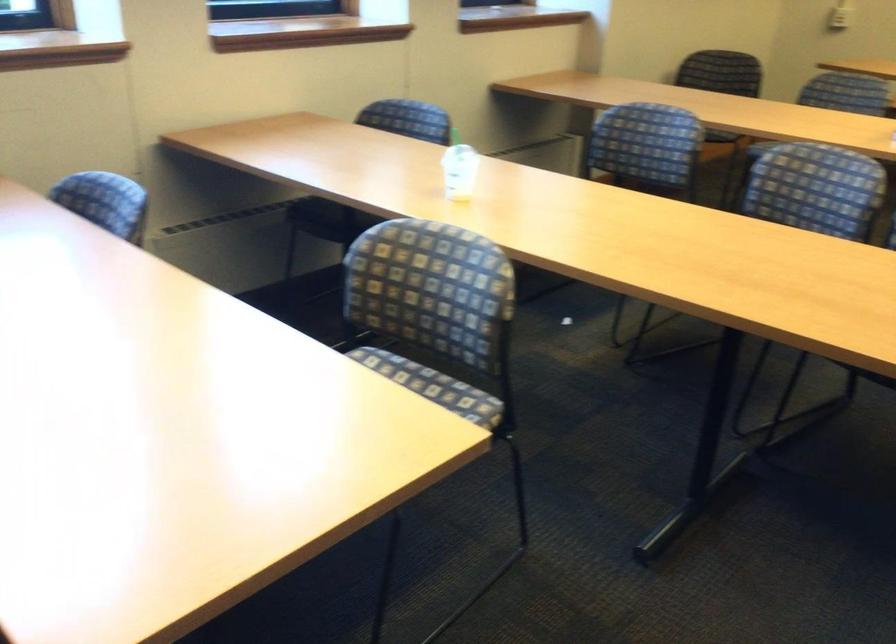
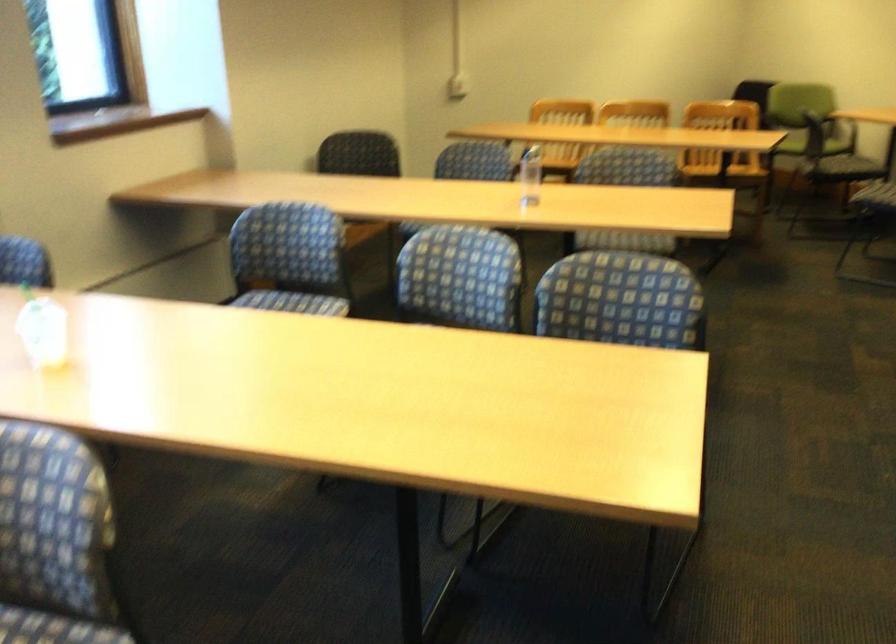
In the second image, find the point that corresponds to the point at 640,152 in the first image.

(289, 259)